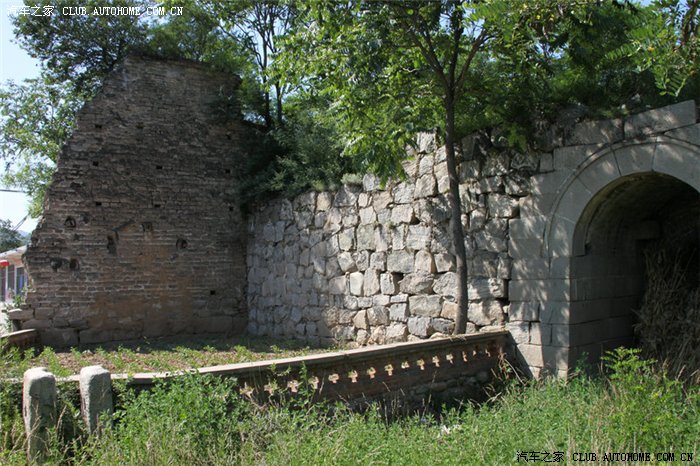
Where is `jagged left edge of crumbling red brick wall`? This screenshot has height=466, width=700. jagged left edge of crumbling red brick wall is located at coordinates (82, 118), (57, 179), (34, 270).